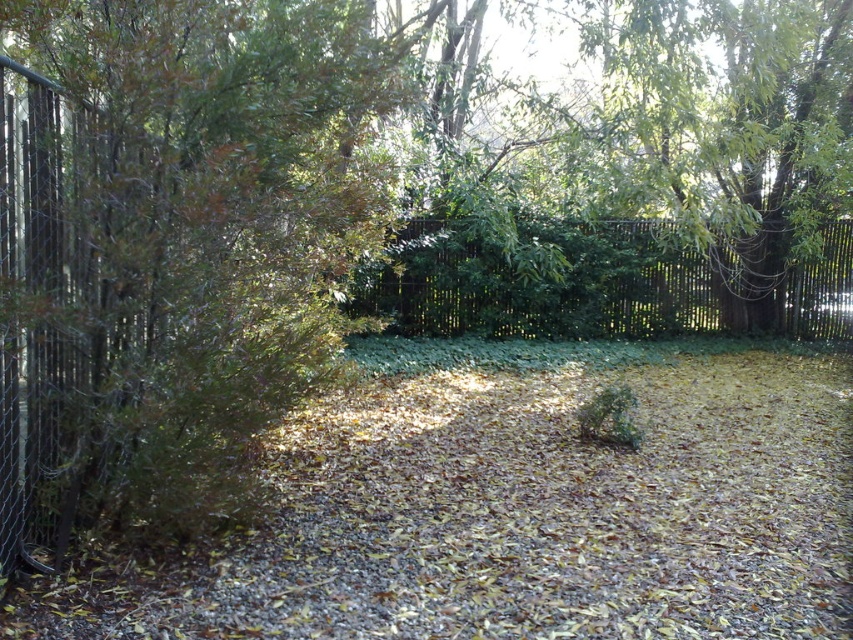
You are a gardener planning to lay a new walkway between the brown gravel path at center and the green wooden fence at center. Which object is wider to determine where to place the walkway?

The brown gravel path at center is wider than the green wooden fence at center, so the walkway should be placed next to the brown gravel path at center to ensure sufficient space.